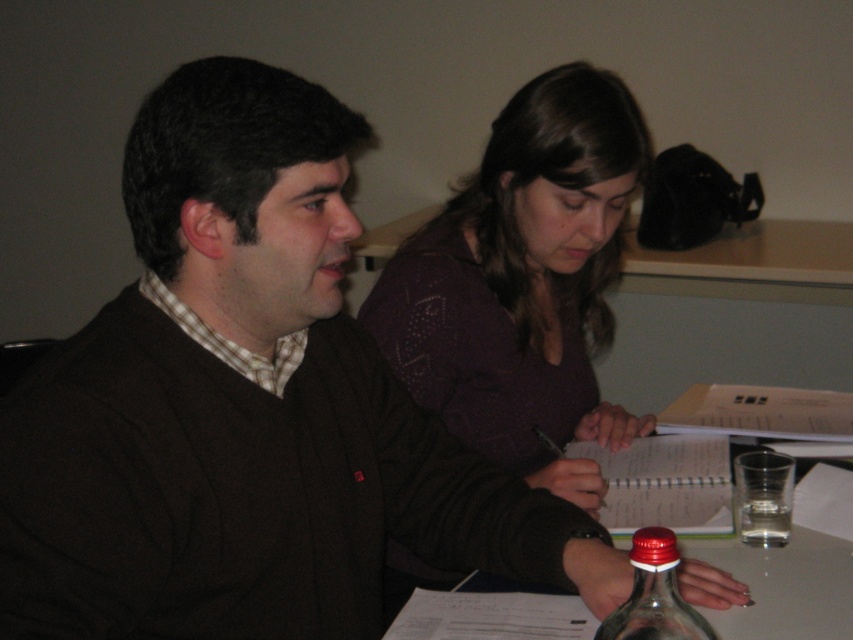
You are a photographer setting up for a group photo. You need to ensure that the purple dotted sweater at upper center and the transparent glass bottle at center are both visible in the frame. Given their sizes, which object should you prioritize positioning closer to the camera to maintain clarity?

The purple dotted sweater at upper center is larger than the transparent glass bottle at center, so you should position the transparent glass bottle at center closer to the camera to maintain clarity since smaller objects need to be nearer to appear clear in the photo.

You are a delivery robot with a 1.2 meter arm. You need to place a package on the table in front of the purple dotted sweater at upper center. Can your arm reach the table from your current position?

The distance between the purple dotted sweater at upper center and the camera is 1.15 meters. Since your arm is 1.2 meters long, it can reach the table in front of the purple dotted sweater at upper center.

You are a photographer setting up for a photo shoot. You need to place a small plant between the clear glass table at center and the transparent glass bottle at center. Based on their positions, where should you place the plant?

The clear glass table at center is located below the transparent glass bottle at center, so you should place the plant between them on the table surface, ensuring it sits above the table and below the bottle.